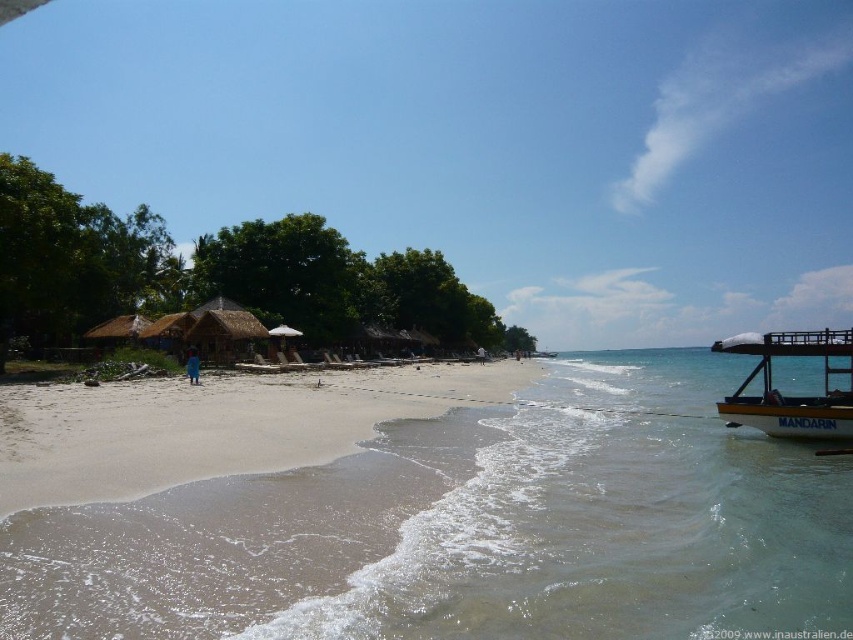
You are standing at the point closest to the beach huts and want to walk towards the water. Which point should you move towards, point (x=434, y=580) or point (x=108, y=515)?

You should move towards point (x=108, y=515) because it is closer to the water than point (x=434, y=580).

You are standing on the sandy beach at lower left and want to reach the yellow wooden boat at right. According to the scene, which direction should you move to get there?

Since the sandy beach at lower left is located above the yellow wooden boat at right, you should move downward towards the yellow wooden boat at right to reach it.